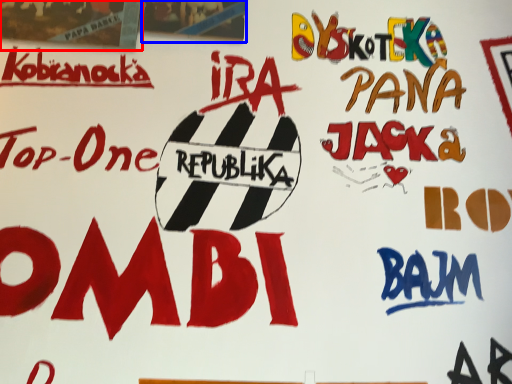
Question: Which object appears closest to the camera in this image, poster (highlighted by a red box) or poster (highlighted by a blue box)?

Choices:
 (A) poster
 (B) poster

Answer: (A)